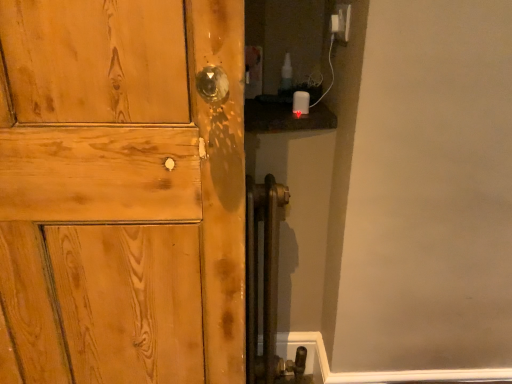
Question: Is there a large distance between matte wood door at center and white plastic electric outlet at upper right?

Choices:
 (A) yes
 (B) no

Answer: (B)

Question: Does matte wood door at center turn towards white plastic electric outlet at upper right?

Choices:
 (A) no
 (B) yes

Answer: (A)

Question: Considering the relative sizes of matte wood door at center and white plastic electric outlet at upper right in the image provided, is matte wood door at center thinner than white plastic electric outlet at upper right?

Choices:
 (A) yes
 (B) no

Answer: (B)

Question: Does matte wood door at center touch white plastic electric outlet at upper right?

Choices:
 (A) no
 (B) yes

Answer: (A)

Question: From the image's perspective, is matte wood door at center below white plastic electric outlet at upper right?

Choices:
 (A) yes
 (B) no

Answer: (A)

Question: Is matte wood door at center turned away from white plastic electric outlet at upper right?

Choices:
 (A) yes
 (B) no

Answer: (B)

Question: Can you confirm if white plastic electric outlet at upper right is thinner than matte wood door at center?

Choices:
 (A) yes
 (B) no

Answer: (A)

Question: Is white plastic electric outlet at upper right far from matte wood door at center?

Choices:
 (A) yes
 (B) no

Answer: (B)

Question: Is white plastic electric outlet at upper right located outside matte wood door at center?

Choices:
 (A) no
 (B) yes

Answer: (B)

Question: From the image's perspective, is white plastic electric outlet at upper right over matte wood door at center?

Choices:
 (A) yes
 (B) no

Answer: (A)

Question: Is the position of white plastic electric outlet at upper right more distant than that of matte wood door at center?

Choices:
 (A) yes
 (B) no

Answer: (A)

Question: Is white plastic electric outlet at upper right to the right of matte wood door at center from the viewer's perspective?

Choices:
 (A) no
 (B) yes

Answer: (B)

Question: Visually, is matte wood door at center positioned to the left or to the right of white plastic electric outlet at upper right?

Choices:
 (A) left
 (B) right

Answer: (A)